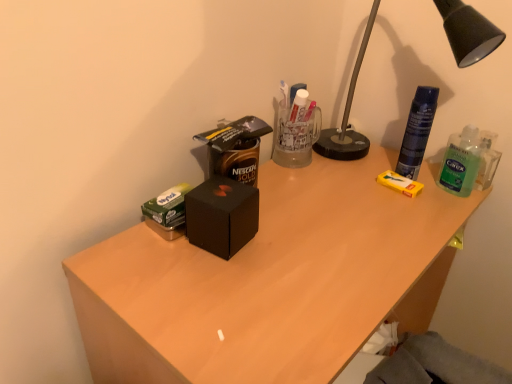
Identify the location of vacant space situated above matte black box at center (from a real-world perspective). This screenshot has width=512, height=384. [318, 217].